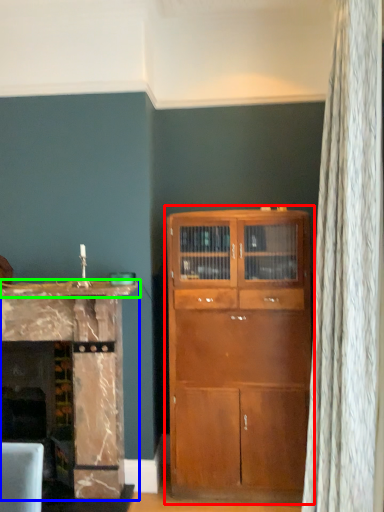
Question: Considering the real-world distances, which object is closest to cupboard (highlighted by a red box)? cabinetry (highlighted by a blue box) or counter top (highlighted by a green box).

Choices:
 (A) cabinetry
 (B) counter top

Answer: (A)